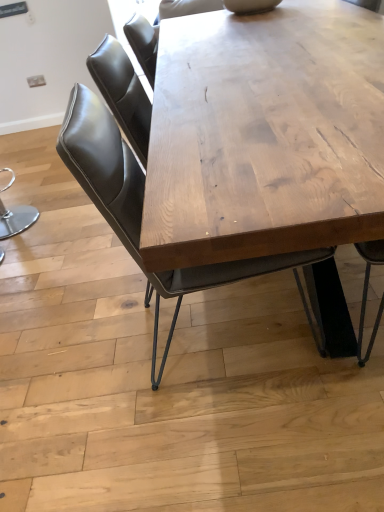
Question: Is leather seat at center directly adjacent to natural wood table at center?

Choices:
 (A) yes
 (B) no

Answer: (B)

Question: Is leather seat at center far away from natural wood table at center?

Choices:
 (A) yes
 (B) no

Answer: (B)

Question: Considering the relative sizes of leather seat at center and natural wood table at center in the image provided, is leather seat at center taller than natural wood table at center?

Choices:
 (A) yes
 (B) no

Answer: (A)

Question: From the image's perspective, is leather seat at center on natural wood table at center?

Choices:
 (A) yes
 (B) no

Answer: (B)

Question: Is leather seat at center thinner than natural wood table at center?

Choices:
 (A) yes
 (B) no

Answer: (A)

Question: From a real-world perspective, is leather seat at center located higher than natural wood table at center?

Choices:
 (A) no
 (B) yes

Answer: (B)

Question: Is the depth of natural wood table at center less than that of leather seat at center?

Choices:
 (A) no
 (B) yes

Answer: (B)

Question: Is natural wood table at center smaller than leather seat at center?

Choices:
 (A) no
 (B) yes

Answer: (A)

Question: Is natural wood table at center aimed at leather seat at center?

Choices:
 (A) yes
 (B) no

Answer: (A)

Question: Can you confirm if natural wood table at center is taller than leather seat at center?

Choices:
 (A) no
 (B) yes

Answer: (A)

Question: Can you confirm if natural wood table at center is thinner than leather seat at center?

Choices:
 (A) no
 (B) yes

Answer: (A)

Question: Can you confirm if natural wood table at center is positioned to the right of leather seat at center?

Choices:
 (A) no
 (B) yes

Answer: (B)

Question: Looking at the image, does leather seat at center seem bigger or smaller compared to natural wood table at center?

Choices:
 (A) big
 (B) small

Answer: (B)